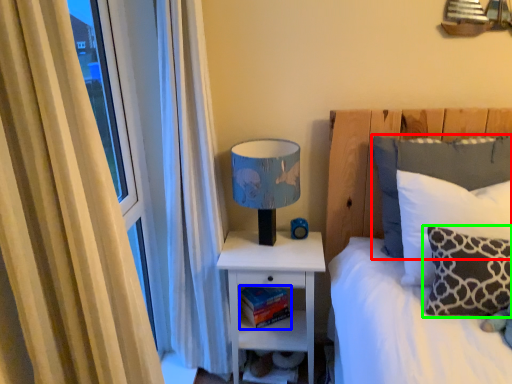
Question: Which object is positioned farthest from pillow (highlighted by a red box)? Select from book (highlighted by a blue box) and pillow (highlighted by a green box).

Choices:
 (A) book
 (B) pillow

Answer: (A)